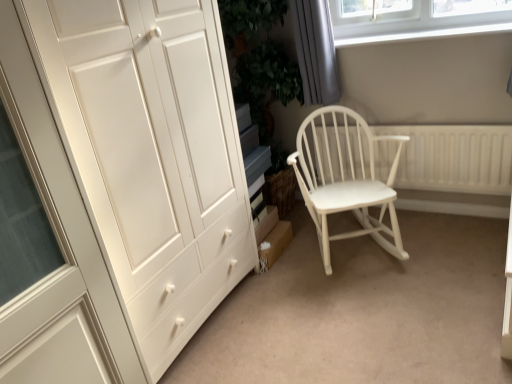
Locate an element on the screen. free space in front of white wood rocking chair at center is located at coordinates (377, 309).